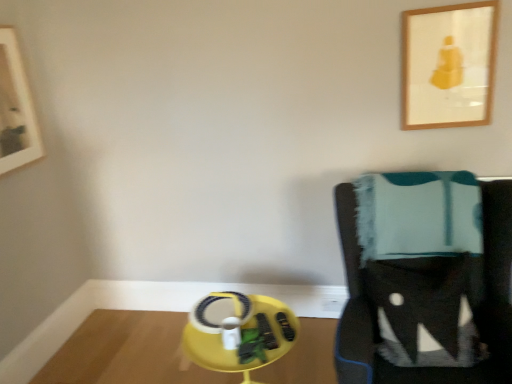
The height and width of the screenshot is (384, 512). Find the location of `blank space situated above yellow plastic table at lower center (from a real-world perspective)`. blank space situated above yellow plastic table at lower center (from a real-world perspective) is located at coordinates (146, 350).